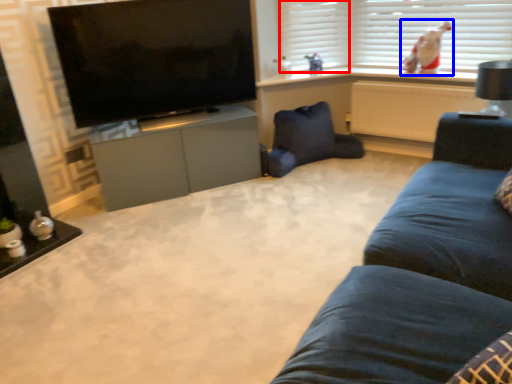
Question: Which of the following is the farthest to the observer, shutter (highlighted by a red box) or person (highlighted by a blue box)?

Choices:
 (A) shutter
 (B) person

Answer: (A)